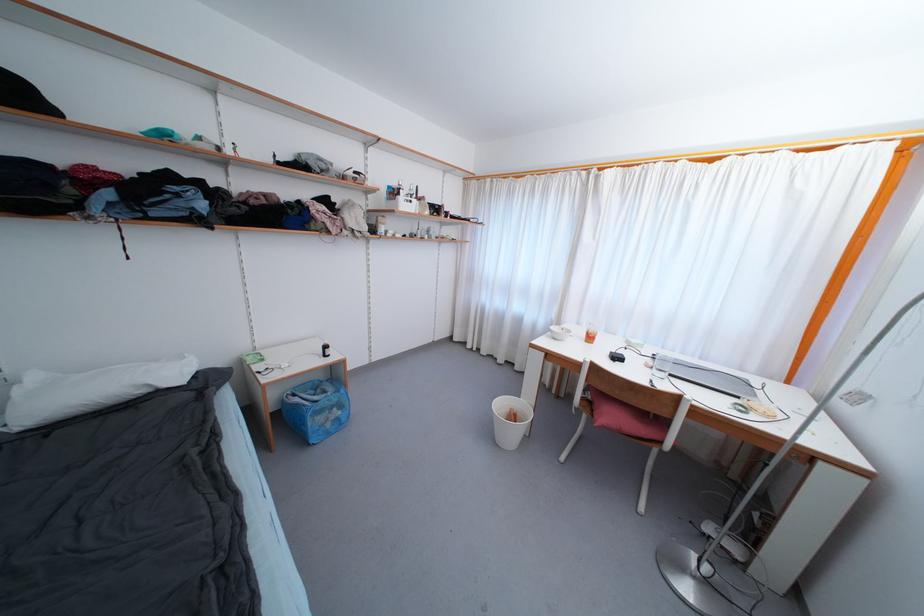
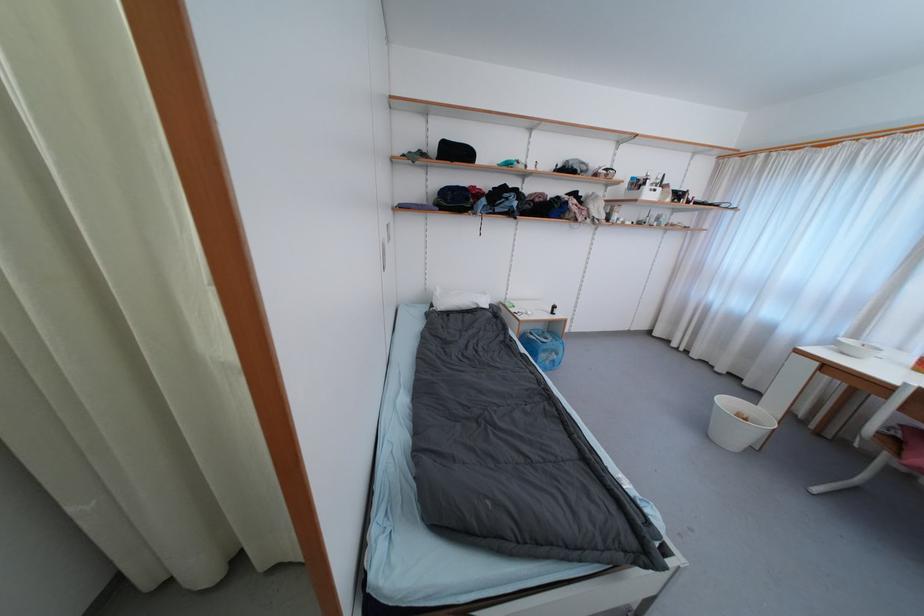
The point at (188,360) is marked in the first image. Where is the corresponding point in the second image?

(489, 296)